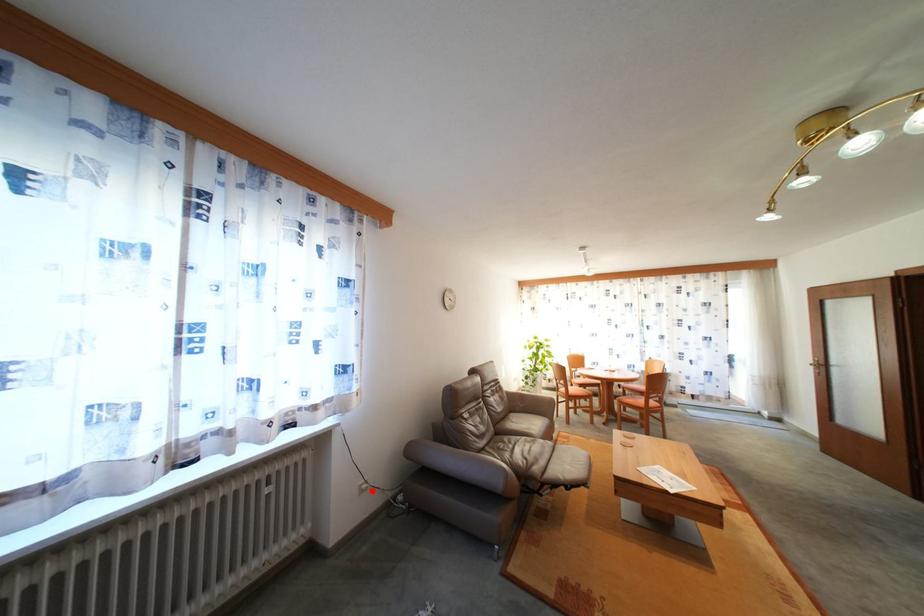
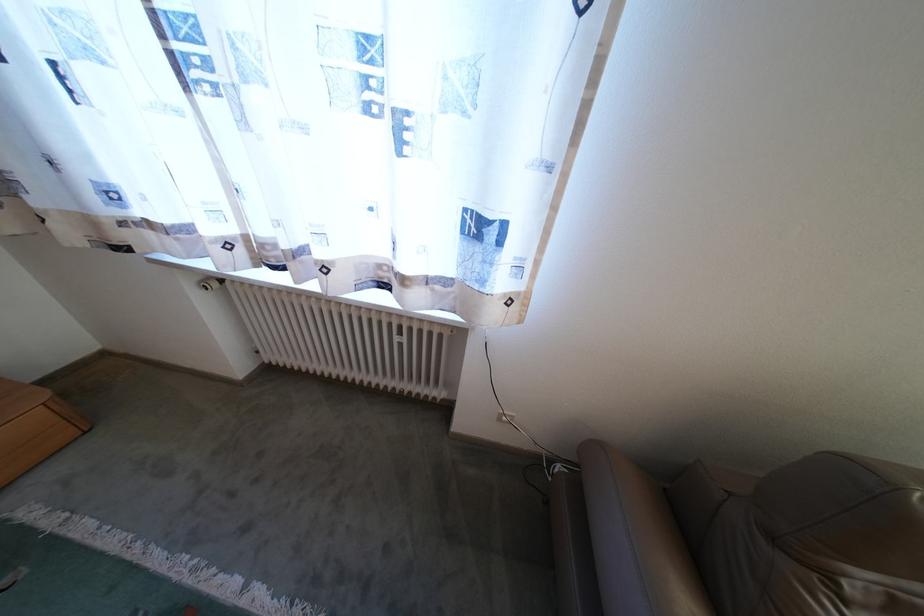
Question: I am providing you with two images of the same scene from different viewpoints. Given a red point in image1, look at the same physical point in image2. Is it:

Choices:
 (A) Closer to the viewpoint
 (B) Farther from the viewpoint

Answer: (B)